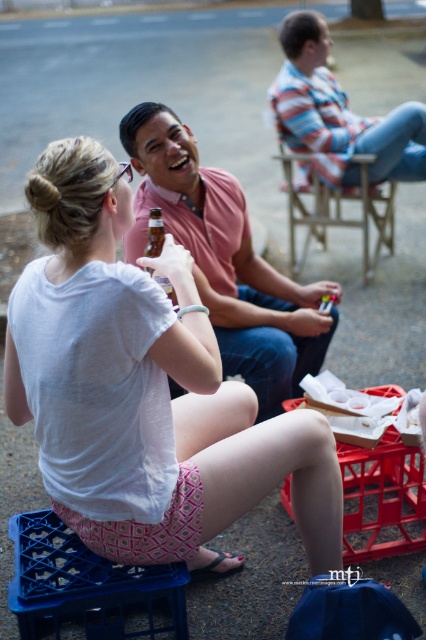
You are planning to take a photo of the two people at the center of the image. The pink cotton shirt at center and the wooden chair at center are both in your frame. Which object takes up more space in the photo?

The wooden chair at center takes up more space in the photo because the pink cotton shirt at center occupies less space than the wooden chair at center.

You are a photographer standing at the center of the scene. You want to take a photo that includes both the striped cotton shirt at upper right and the brown glass bottle at center. What is the minimum distance you need to move backward to ensure both objects are in frame?

The striped cotton shirt at upper right is 7.47 feet away from the brown glass bottle at center. To include both in the frame, you need to move backward until you can cover this distance in your camera view.

You are standing in the outdoor gathering scene. There is a wooden chair at center and a brown glass bottle at center. Which object is located to the right of the other?

The wooden chair at center is to the right of the brown glass bottle at center.